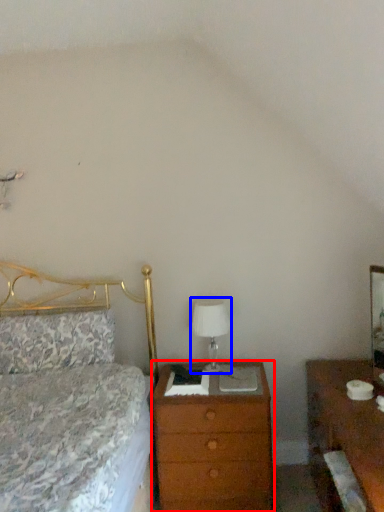
Question: Which object is closer to the camera taking this photo, chest of drawers (highlighted by a red box) or table lamp (highlighted by a blue box)?

Choices:
 (A) chest of drawers
 (B) table lamp

Answer: (A)